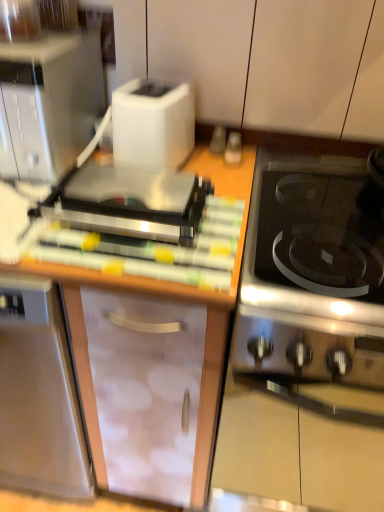
This screenshot has width=384, height=512. What do you see at coordinates (131, 202) in the screenshot? I see `satin silver toaster at upper left` at bounding box center [131, 202].

Where is `satin silver toaster at upper left`? satin silver toaster at upper left is located at coordinates (131, 202).

Identify the location of white plastic toaster at upper center. (153, 123).

The height and width of the screenshot is (512, 384). I want to click on wooden cutting board at center, so click(134, 276).

At what (x,y) coordinates should I click in order to perform the action: click on stainless steel oven at right. Please return your answer as a coordinate pair (x, y). The height and width of the screenshot is (512, 384). Looking at the image, I should click on point(307,336).

This screenshot has height=512, width=384. What do you see at coordinates (48, 103) in the screenshot?
I see `satin silver microwave at upper left` at bounding box center [48, 103].

This screenshot has height=512, width=384. I want to click on satin silver microwave at upper left, so click(x=48, y=103).

Where is `satin silver toaster at upper left`? This screenshot has width=384, height=512. satin silver toaster at upper left is located at coordinates (131, 202).

Is stainless steel oven at right at the right side of satin silver toaster at upper left?

Indeed, stainless steel oven at right is positioned on the right side of satin silver toaster at upper left.

Is stainless steel oven at right positioned with its back to satin silver toaster at upper left?

No, stainless steel oven at right is not facing the opposite direction of satin silver toaster at upper left.

Where is `oven that appears in front of the satin silver toaster at upper left`? oven that appears in front of the satin silver toaster at upper left is located at coordinates (307, 336).

Does point (258, 292) come closer to viewer compared to point (114, 207)?

Yes, it is.

Considering the relative positions of black glass cooktop at right and stainless steel oven at right in the image provided, is black glass cooktop at right behind stainless steel oven at right?

No, it is not.

Are black glass cooktop at right and stainless steel oven at right located far from each other?

They are positioned close to each other.

Which of these two, black glass cooktop at right or stainless steel oven at right, is smaller?

With smaller size is black glass cooktop at right.

From a real-world perspective, is black glass cooktop at right on stainless steel oven at right?

Yes.

Is satin silver toaster at upper left inside white plastic toaster at upper center?

Actually, satin silver toaster at upper left is outside white plastic toaster at upper center.

Considering the sizes of objects white plastic toaster at upper center and satin silver toaster at upper left in the image provided, who is smaller, white plastic toaster at upper center or satin silver toaster at upper left?

satin silver toaster at upper left.

Can you confirm if white plastic toaster at upper center is positioned to the left of satin silver toaster at upper left?

In fact, white plastic toaster at upper center is to the right of satin silver toaster at upper left.

Is white plastic toaster at upper center next to satin silver toaster at upper left and touching it?

No, white plastic toaster at upper center is not making contact with satin silver toaster at upper left.

Can you confirm if white plastic toaster at upper center is positioned to the left of white matte toaster at upper left, which appears as the second cabinetry when ordered from the bottom?

Yes.

Are white plastic toaster at upper center and white matte toaster at upper left, the 1th cabinetry positioned from the top, beside each other?

No, white plastic toaster at upper center is not beside white matte toaster at upper left, the 1th cabinetry positioned from the top.

From a real-world perspective, is white plastic toaster at upper center positioned under white matte toaster at upper left, which appears as the second cabinetry when ordered from the bottom, based on gravity?

Correct, in the physical world, white plastic toaster at upper center is lower than white matte toaster at upper left, which appears as the second cabinetry when ordered from the bottom.

Is white plastic toaster at upper center not within white matte toaster at upper left, which appears as the second cabinetry when ordered from the bottom?

That's correct, white plastic toaster at upper center is outside of white matte toaster at upper left, which appears as the second cabinetry when ordered from the bottom.

This screenshot has width=384, height=512. In order to click on the 1st cabinetry counting from the right of the satin silver microwave at upper left in this screenshot , I will do `click(115, 372)`.

Is point (90, 129) in front of point (36, 392)?

No, (90, 129) is further to viewer.

Looking at their sizes, would you say satin silver microwave at upper left is wider or thinner than transparent plastic cabinet at center, which is counted as the 1th cabinetry, starting from the bottom?

satin silver microwave at upper left is thinner than transparent plastic cabinet at center, which is counted as the 1th cabinetry, starting from the bottom.

From the image's perspective, which one is positioned higher, satin silver toaster at upper left or white plastic toaster at upper center?

From the image's view, white plastic toaster at upper center is above.

Is white plastic toaster at upper center inside satin silver toaster at upper left?

No, white plastic toaster at upper center is not surrounded by satin silver toaster at upper left.

Based on the photo, considering the positions of objects satin silver toaster at upper left and white plastic toaster at upper center in the image provided, who is behind, satin silver toaster at upper left or white plastic toaster at upper center?

white plastic toaster at upper center is further from the camera.

Consider the image. Is wooden cutting board at center smaller than black glass cooktop at right?

Indeed, wooden cutting board at center has a smaller size compared to black glass cooktop at right.

From the image's perspective, is wooden cutting board at center located above or below black glass cooktop at right?

From the image's perspective, wooden cutting board at center appears below black glass cooktop at right.

Can you confirm if wooden cutting board at center is shorter than black glass cooktop at right?

Yes.

How many degrees apart are the facing directions of wooden cutting board at center and black glass cooktop at right?

The angular difference between wooden cutting board at center and black glass cooktop at right is 87.4 degrees.

Locate an element on the screen. The image size is (384, 512). appliance above the stainless steel oven at right (from a real-world perspective) is located at coordinates (131, 202).

Find the location of `gas stove located above the stainless steel oven at right (from the image's perspective)`. gas stove located above the stainless steel oven at right (from the image's perspective) is located at coordinates (315, 240).

Considering their positions, is satin silver microwave at upper left positioned further to white matte toaster at upper left, which appears as the second cabinetry when ordered from the bottom, than transparent plastic cabinet at center, which is the second cabinetry from top to bottom?

Among the two, transparent plastic cabinet at center, which is the second cabinetry from top to bottom, is located further to white matte toaster at upper left, which appears as the second cabinetry when ordered from the bottom.

Estimate the real-world distances between objects in this image. Which object is further from satin silver toaster at upper left, wooden cutting board at center or transparent plastic cabinet at center, which is the second cabinetry from top to bottom?

Based on the image, transparent plastic cabinet at center, which is the second cabinetry from top to bottom, appears to be further to satin silver toaster at upper left.

Considering their positions, is satin silver toaster at upper left positioned further to white matte toaster at upper left, the 1th cabinetry positioned from the top, than white plastic toaster at upper center?

The object further to white matte toaster at upper left, the 1th cabinetry positioned from the top, is satin silver toaster at upper left.

Based on their spatial positions, is satin silver microwave at upper left or stainless steel oven at right further from satin silver toaster at upper left?

stainless steel oven at right lies further to satin silver toaster at upper left than the other object.

Estimate the real-world distances between objects in this image. Which object is closer to stainless steel oven at right, white plastic toaster at upper center or satin silver toaster at upper left?

satin silver toaster at upper left is positioned closer to the anchor stainless steel oven at right.

Looking at the image, which one is located further to stainless steel oven at right, white plastic toaster at upper center or transparent plastic cabinet at center, which is the second cabinetry from top to bottom?

white plastic toaster at upper center lies further to stainless steel oven at right than the other object.

Estimate the real-world distances between objects in this image. Which object is closer to stainless steel oven at right, transparent plastic cabinet at center, which is the second cabinetry from top to bottom, or satin silver toaster at upper left?

transparent plastic cabinet at center, which is the second cabinetry from top to bottom, is closer to stainless steel oven at right.

Consider the image. Considering their positions, is transparent plastic cabinet at center, which is the second cabinetry from top to bottom, positioned further to satin silver microwave at upper left than black glass cooktop at right?

black glass cooktop at right is further to satin silver microwave at upper left.

This screenshot has width=384, height=512. I want to click on toaster located between satin silver microwave at upper left and white matte toaster at upper left, the 1th cabinetry positioned from the top, in the left-right direction, so click(x=153, y=123).

Where is `appliance between satin silver microwave at upper left and wooden cutting board at center`? appliance between satin silver microwave at upper left and wooden cutting board at center is located at coordinates (131, 202).

Find the location of `toaster between white matte toaster at upper left, the 1th cabinetry positioned from the top, and stainless steel oven at right vertically`. toaster between white matte toaster at upper left, the 1th cabinetry positioned from the top, and stainless steel oven at right vertically is located at coordinates (153, 123).

Find the location of a particular element. Image resolution: width=384 pixels, height=512 pixels. appliance between satin silver microwave at upper left and white plastic toaster at upper center is located at coordinates (131, 202).